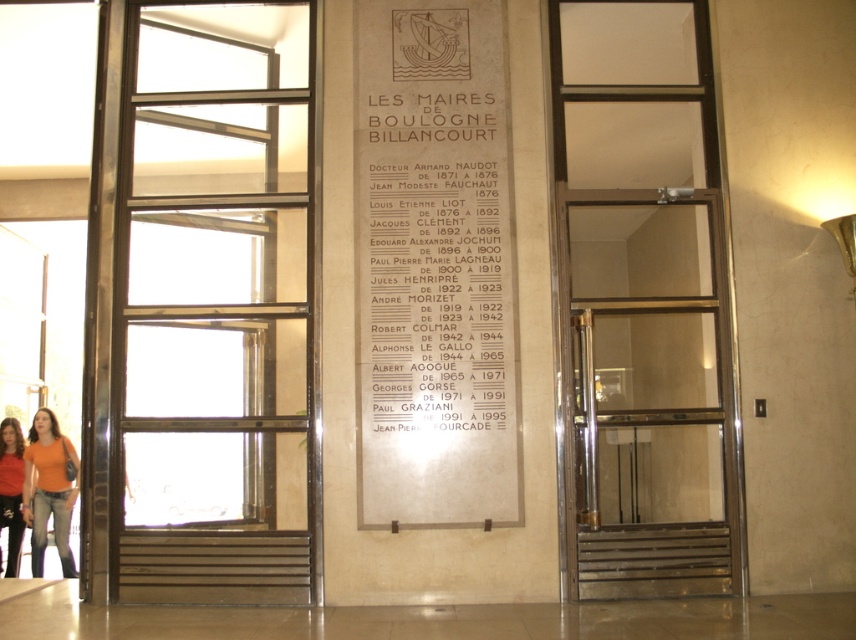
Which is behind, point (102, 188) or point (13, 472)?

Positioned behind is point (13, 472).

Does point (295, 38) come farther from viewer compared to point (9, 474)?

No, it is not.

Where is `polished metal elevator at center`? The height and width of the screenshot is (640, 856). polished metal elevator at center is located at coordinates (206, 305).

From the picture: Measure the distance between polished metal elevator at center and polished brass elevator at center.

A distance of 2.87 meters exists between polished metal elevator at center and polished brass elevator at center.

Does point (171, 260) come in front of point (681, 401)?

Yes, it is.

I want to click on polished metal elevator at center, so click(x=206, y=305).

Is point (474, 352) farther from camera compared to point (61, 532)?

No.

Between white paper at center and orange t-shirt at lower left, which one is positioned higher?

Positioned higher is white paper at center.

Consider the image. Measure the distance between white paper at center and camera.

5.71 meters

Where is `white paper at center`? The image size is (856, 640). white paper at center is located at coordinates (432, 266).